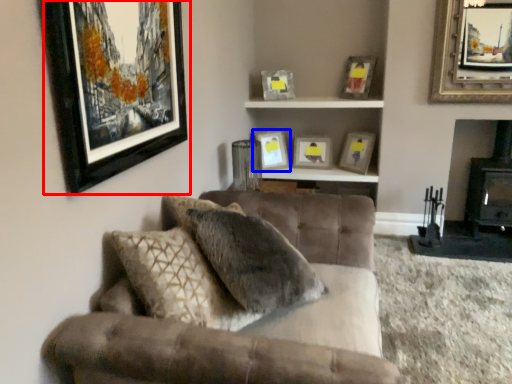
Question: Which object appears farthest to the camera in this image, picture frame (highlighted by a red box) or picture frame (highlighted by a blue box)?

Choices:
 (A) picture frame
 (B) picture frame

Answer: (B)